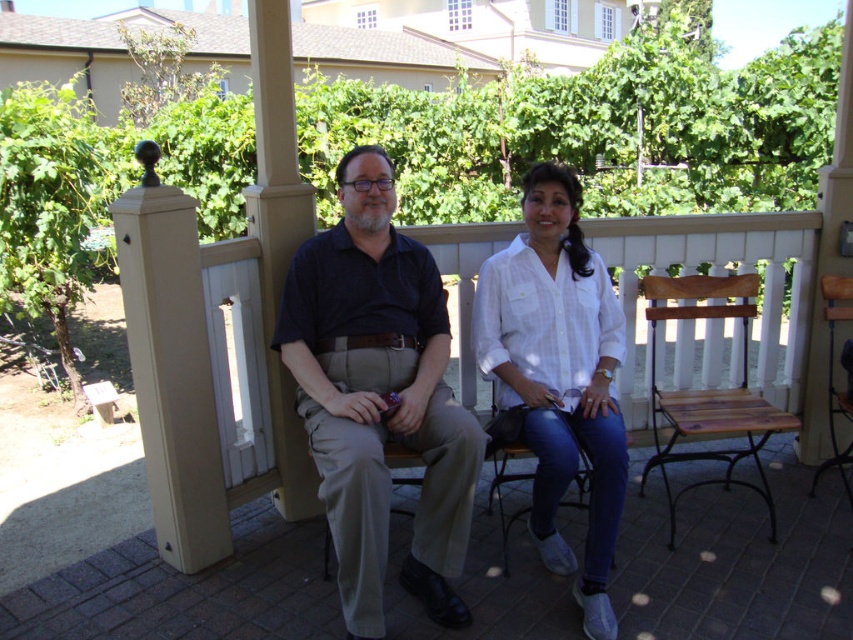
Between point (122, 252) and point (654, 323), which one is positioned behind?

Point (654, 323)

Measure the distance between point [791,234] and camera.

Point [791,234] and camera are 3.27 meters apart.

The image size is (853, 640). Identify the location of wooden bench at center. (207, 364).

Identify the location of white cotton shirt at center. (560, 374).

Image resolution: width=853 pixels, height=640 pixels. What do you see at coordinates (560, 374) in the screenshot?
I see `white cotton shirt at center` at bounding box center [560, 374].

Does point (596, 422) lie behind point (717, 420)?

That is False.

Image resolution: width=853 pixels, height=640 pixels. I want to click on white cotton shirt at center, so click(x=560, y=374).

Does dark blue shirt at center have a greater height compared to wooden seat at right?

Yes, dark blue shirt at center is taller than wooden seat at right.

Locate an element on the screen. dark blue shirt at center is located at coordinates (378, 396).